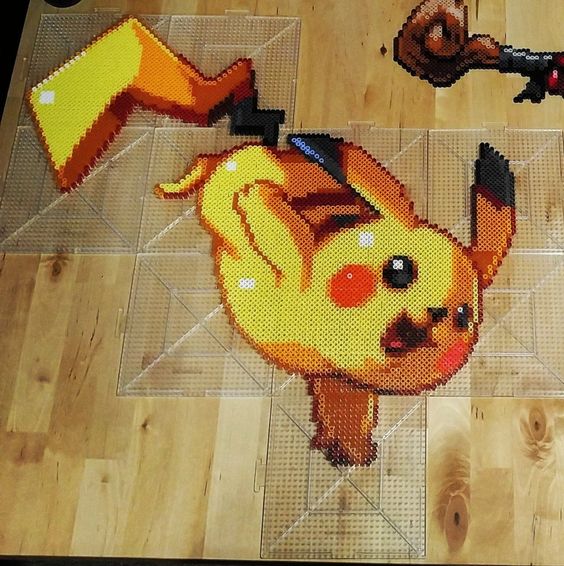
The image size is (564, 566). What are the coordinates of `wood floor` in the screenshot? It's located at (503, 473).